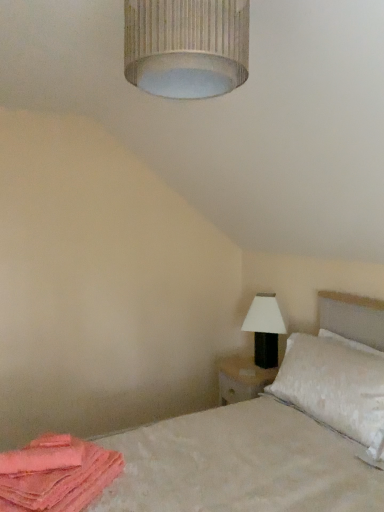
Question: Is white matte table lamp at right wider or thinner than white textured lampshade at upper center?

Choices:
 (A) wide
 (B) thin

Answer: (A)

Question: Relative to white textured lampshade at upper center, is white matte table lamp at right in front or behind?

Choices:
 (A) front
 (B) behind

Answer: (B)

Question: Based on their relative distances, which object is farther from the white textured bed at lower right?

Choices:
 (A) pink fabric at lower left
 (B) white textured lampshade at upper center
 (C) white matte table lamp at right
 (D) white textured pillow at right

Answer: (B)

Question: Estimate the real-world distances between objects in this image. Which object is closer to the white textured bed at lower right?

Choices:
 (A) pink fabric at lower left
 (B) white matte table lamp at right
 (C) white textured pillow at right
 (D) white textured lampshade at upper center

Answer: (C)